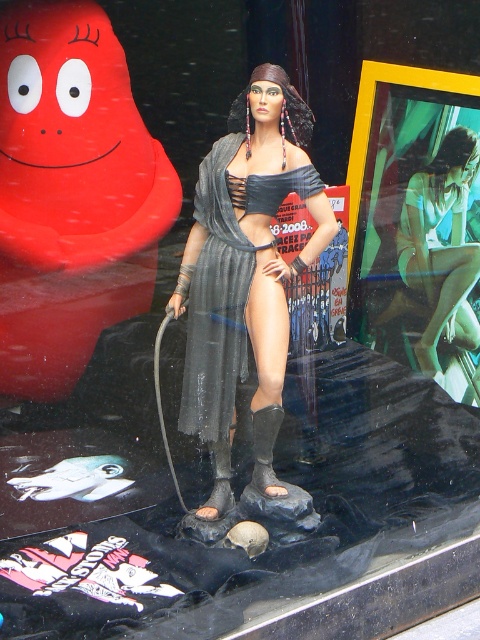
Based on the photo, does gray fabric dress at center have a lesser height compared to matte green shorts at center?

Yes.

Is point (207, 410) positioned in front of point (436, 264)?

Yes, it is in front of point (436, 264).

Identify the location of gray fabric dress at center. (216, 301).

Consider the image. Can you confirm if matte red rubber at upper left is positioned above matte green shorts at center?

Correct, matte red rubber at upper left is located above matte green shorts at center.

Consider the image. Is matte red rubber at upper left thinner than matte green shorts at center?

No.

Is point (121, 284) positioned before point (448, 170)?

Yes, point (121, 284) is in front of point (448, 170).

Where is `matte red rubber at upper left`? matte red rubber at upper left is located at coordinates (71, 193).

Can you confirm if matte red rubber at upper left is positioned to the right of gray fabric dress at center?

No, matte red rubber at upper left is not to the right of gray fabric dress at center.

Who is positioned more to the left, matte red rubber at upper left or gray fabric dress at center?

Positioned to the left is matte red rubber at upper left.

Which is in front, point (52, 99) or point (218, 214)?

Positioned in front is point (218, 214).

What are the coordinates of `matte red rubber at upper left` in the screenshot? It's located at (71, 193).